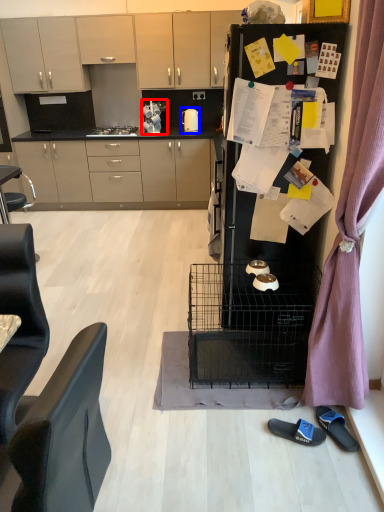
Question: Among these objects, which one is nearest to the camera, appliance (highlighted by a red box) or kitchen appliance (highlighted by a blue box)?

Choices:
 (A) appliance
 (B) kitchen appliance

Answer: (A)